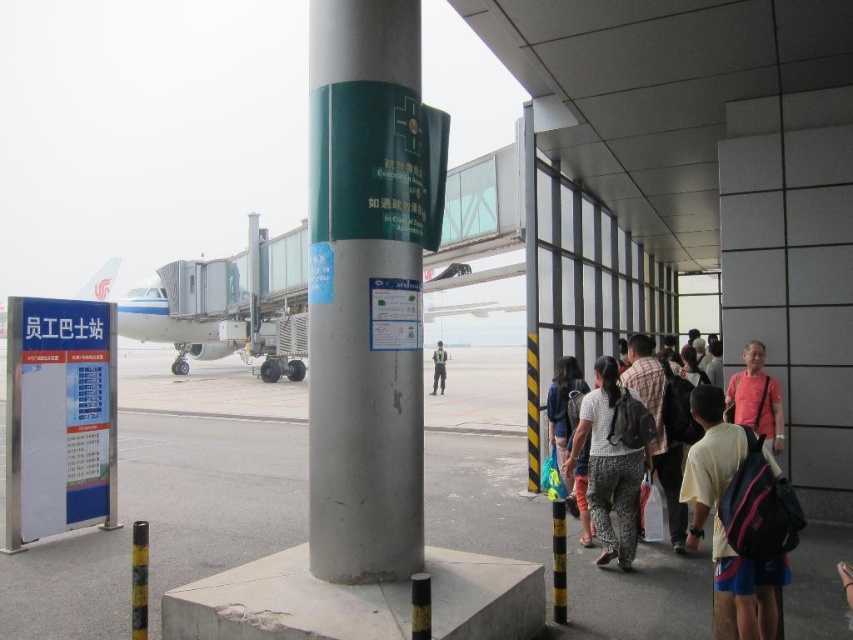
Question: Among these points, which one is nearest to the camera?

Choices:
 (A) (340, 259)
 (B) (433, 387)
 (C) (619, 353)

Answer: (A)

Question: Which object is the closest to the light yellow fabric shirt at lower right?

Choices:
 (A) gray asphalt tarmac at center
 (B) light brown backpack at center
 (C) white textured shirt at center
 (D) silver metallic pole at center

Answer: (C)

Question: Among these points, which one is nearest to the camera?

Choices:
 (A) (699, 456)
 (B) (538, 534)
 (C) (747, 364)
 (D) (653, 444)

Answer: (A)

Question: Is light brown backpack at center thinner than dark gray uniform at center?

Choices:
 (A) yes
 (B) no

Answer: (A)

Question: Is white textured shirt at center above dark gray uniform at center?

Choices:
 (A) no
 (B) yes

Answer: (B)

Question: Does gray asphalt tarmac at center have a smaller size compared to dark gray uniform at center?

Choices:
 (A) yes
 (B) no

Answer: (B)